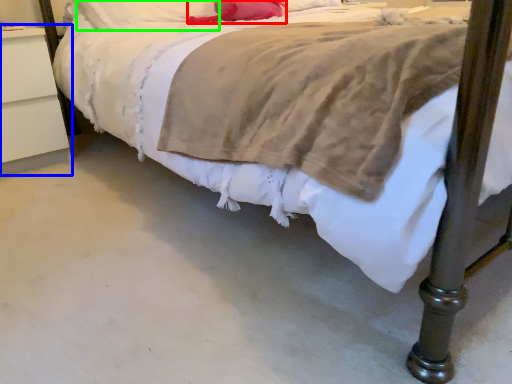
Question: Which object is positioned farthest from pillow (highlighted by a red box)? Select from nightstand (highlighted by a blue box) and pillow (highlighted by a green box).

Choices:
 (A) nightstand
 (B) pillow

Answer: (A)